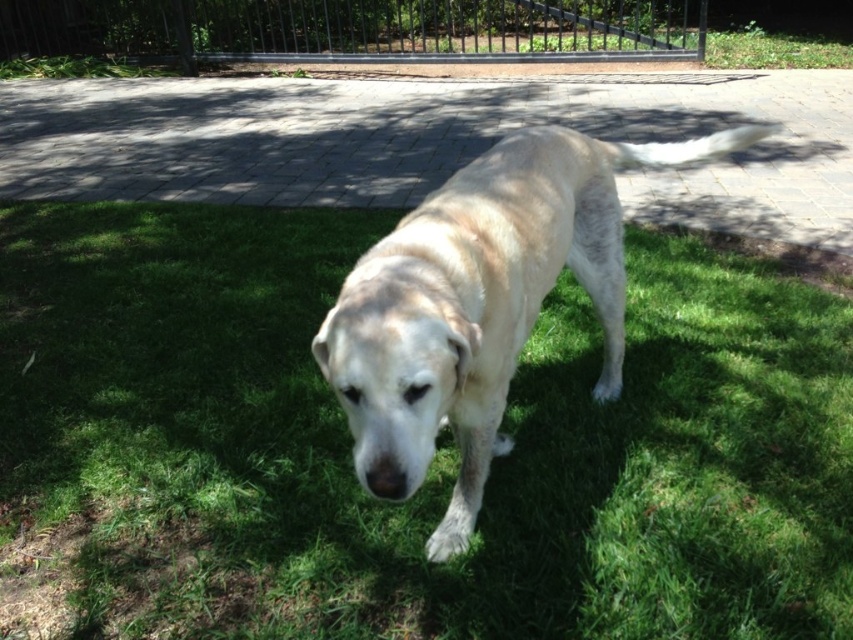
Question: Does light beige fur dog at center have a greater width compared to black metal fence at upper center?

Choices:
 (A) yes
 (B) no

Answer: (B)

Question: Is green grass at center positioned in front of light beige fur dog at center?

Choices:
 (A) yes
 (B) no

Answer: (B)

Question: Is green grass at center thinner than black metal fence at upper center?

Choices:
 (A) no
 (B) yes

Answer: (B)

Question: Among these objects, which one is farthest from the camera?

Choices:
 (A) green grass at center
 (B) black metal fence at upper center

Answer: (B)

Question: Which point appears closest to the camera in this image?

Choices:
 (A) (238, 17)
 (B) (376, 230)
 (C) (604, 374)

Answer: (C)

Question: Which of the following is the closest to the observer?

Choices:
 (A) (531, 44)
 (B) (817, 445)
 (C) (601, 189)

Answer: (C)